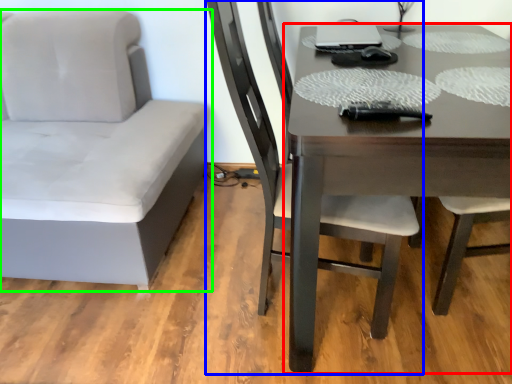
Question: Which object is positioned farthest from table (highlighted by a red box)? Select from chair (highlighted by a blue box) and chair (highlighted by a green box).

Choices:
 (A) chair
 (B) chair

Answer: (B)